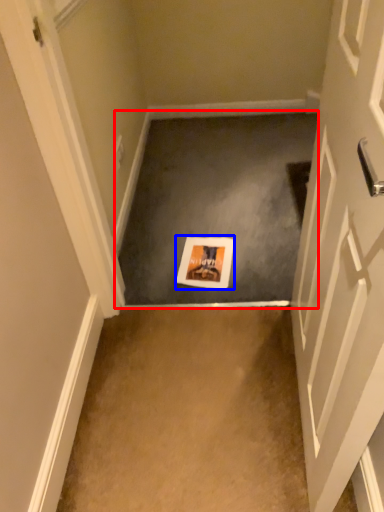
Question: Which point is further to the camera, concrete (highlighted by a red box) or postcard (highlighted by a blue box)?

Choices:
 (A) concrete
 (B) postcard

Answer: (B)